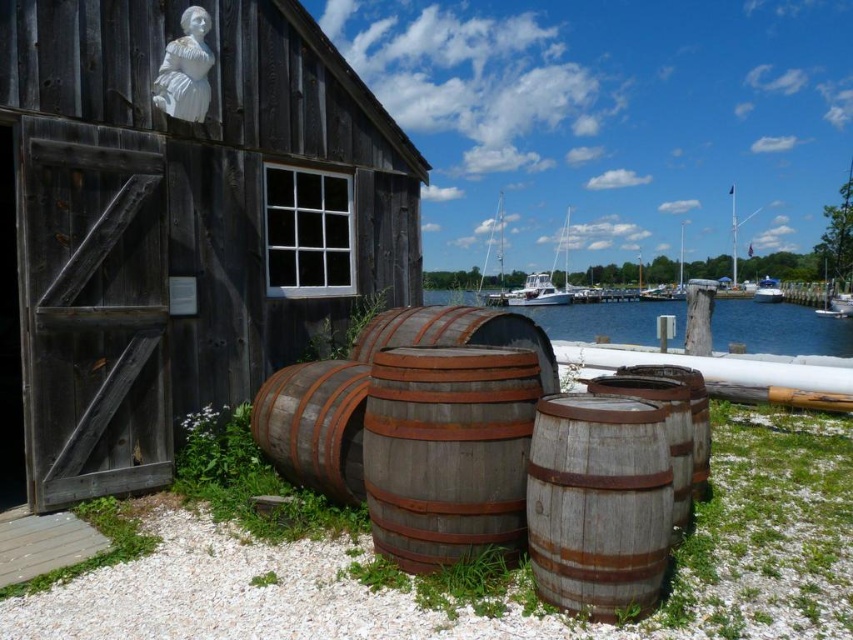
You are standing in front of the rustic wooden building and see the point marked at coordinate (x=49, y=424). If you want to place a 15 feet long ladder diagonally from this point to the building, will the ladder reach the building?

The point marked at coordinate (x=49, y=424) is 14.98 feet away from the viewer. Since the ladder is 15 feet long, it will just barely reach the building.

You are standing in front of the weathered wooden building on the left side. You want to place a small potted plant exactly at the point indicated by the coordinates point (509, 576). According to the scene description, what will be under the potted plant?

The point (509, 576) indicates brown gravel at lower center, so placing the potted plant there would mean it sits directly on the brown gravel at lower center.

You are a painter who wants to paint both the dark brown wooden barn at left and the white glossy boat at right. Since you have a limited amount of paint, which object requires more paint to cover its entire surface area?

The white glossy boat at right requires more paint because it is wider than the dark brown wooden barn at left.